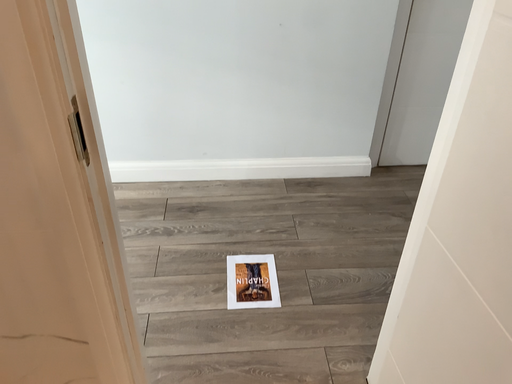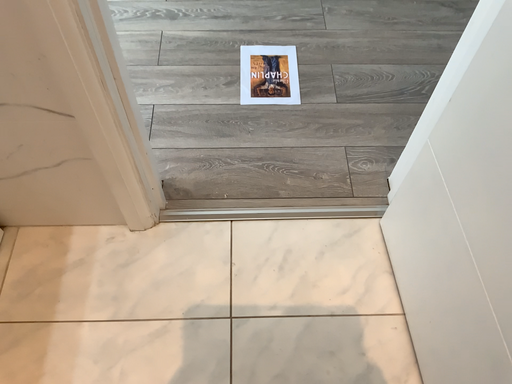
Question: How did the camera likely rotate when shooting the video?

Choices:
 (A) rotated upward
 (B) rotated downward

Answer: (B)